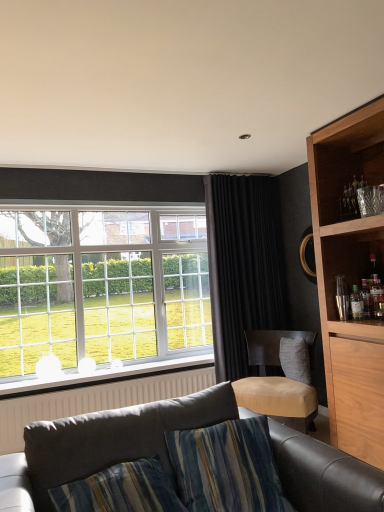
Question: Is translucent glass bottle at right, which is the 1th bottle in left-to-right order, looking in the opposite direction of dark gray fabric couch at lower center?

Choices:
 (A) yes
 (B) no

Answer: (B)

Question: Does translucent glass bottle at right, the 2th bottle from the right, have a greater width compared to dark gray fabric couch at lower center?

Choices:
 (A) no
 (B) yes

Answer: (A)

Question: Can you confirm if translucent glass bottle at right, which is the 1th bottle in left-to-right order, is bigger than dark gray fabric couch at lower center?

Choices:
 (A) yes
 (B) no

Answer: (B)

Question: Does translucent glass bottle at right, the 2th bottle from the right, appear on the left side of dark gray fabric couch at lower center?

Choices:
 (A) no
 (B) yes

Answer: (A)

Question: Does translucent glass bottle at right, the 2th bottle from the right, have a greater height compared to dark gray fabric couch at lower center?

Choices:
 (A) no
 (B) yes

Answer: (A)

Question: From the image's perspective, would you say translucent glass bottle at right, which is the 1th bottle in left-to-right order, is positioned over dark gray fabric couch at lower center?

Choices:
 (A) yes
 (B) no

Answer: (A)

Question: Could translucent glass bottle at right, the 2th bottle from the right, be considered to be inside black velvet curtain at center?

Choices:
 (A) no
 (B) yes

Answer: (A)

Question: Is black velvet curtain at center positioned with its back to translucent glass bottle at right, which is the 1th bottle in left-to-right order?

Choices:
 (A) yes
 (B) no

Answer: (A)

Question: Is black velvet curtain at center facing towards translucent glass bottle at right, the 2th bottle from the right?

Choices:
 (A) no
 (B) yes

Answer: (B)

Question: Is black velvet curtain at center in contact with translucent glass bottle at right, which is the 1th bottle in left-to-right order?

Choices:
 (A) yes
 (B) no

Answer: (B)

Question: Is black velvet curtain at center in front of translucent glass bottle at right, which is the 1th bottle in left-to-right order?

Choices:
 (A) yes
 (B) no

Answer: (B)

Question: Would you say black velvet curtain at center is a long distance from translucent glass bottle at right, the 2th bottle from the right?

Choices:
 (A) no
 (B) yes

Answer: (B)

Question: Is black velvet curtain at center taller than white textured radiator at lower left?

Choices:
 (A) no
 (B) yes

Answer: (B)